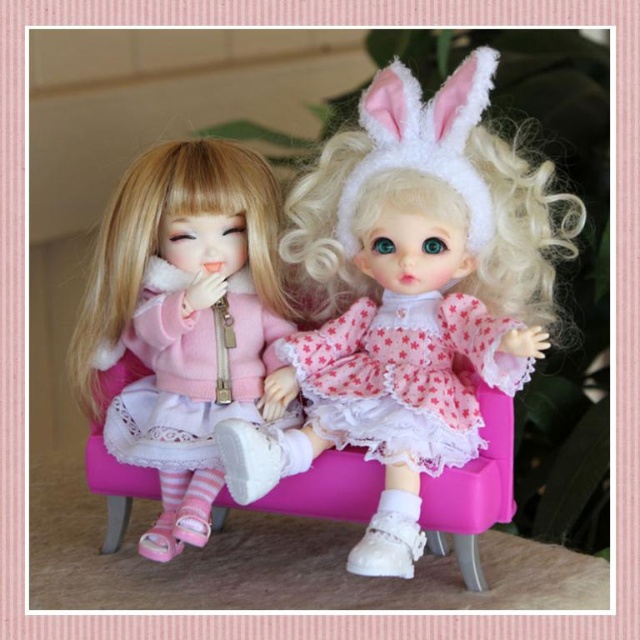
Does pink fabric dress at center have a greater height compared to matte pink fabric dress at left?

Indeed, pink fabric dress at center has a greater height compared to matte pink fabric dress at left.

Between point (444, 157) and point (157, 328), which one is positioned behind?

The point (157, 328) is behind.

You are a GUI agent. You are given a task and a screenshot of the screen. Output one action in this format:
    pyautogui.click(x=<x>, y=<y>)
    Task: Click on the pink fabric dress at center
    
    Given the screenshot: What is the action you would take?
    pyautogui.click(x=406, y=298)

Does matte pink sweater at left have a lesser height compared to matte pink fabric dress at left?

Incorrect, matte pink sweater at left's height does not fall short of matte pink fabric dress at left's.

Is the position of matte pink sweater at left more distant than that of matte pink fabric dress at left?

No, matte pink sweater at left is closer to the viewer.

The height and width of the screenshot is (640, 640). Find the location of `matte pink sweater at left`. matte pink sweater at left is located at coordinates (180, 320).

Can you confirm if pink fabric dress at center is shorter than pink lace dress at center?

In fact, pink fabric dress at center may be taller than pink lace dress at center.

How far apart are pink fabric dress at center and pink lace dress at center?

pink fabric dress at center and pink lace dress at center are 1.96 inches apart.

At what (x,y) coordinates should I click in order to perform the action: click on pink fabric dress at center. Please return your answer as a coordinate pair (x, y). Looking at the image, I should click on (406, 298).